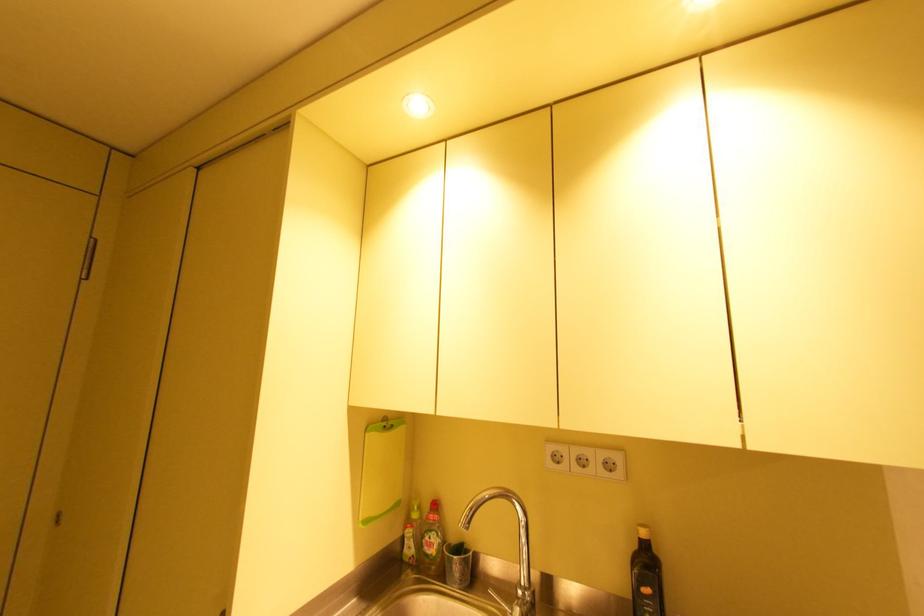
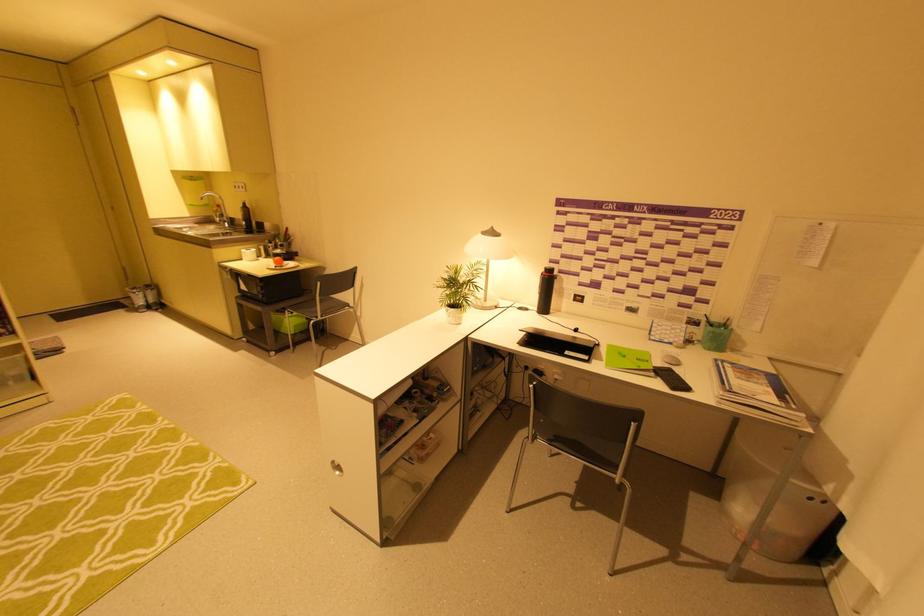
Where in the second image is the point corresponding to (405,536) from the first image?

(215, 215)